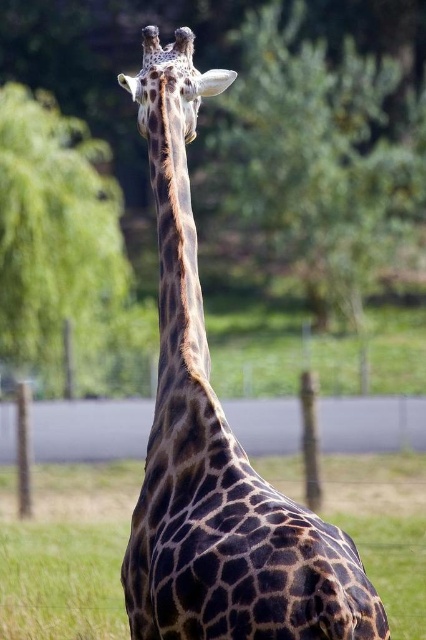
Which is above, spotted fur giraffe at center or brown textured neck at center?

brown textured neck at center

Between point (178, 586) and point (155, 147), which one is positioned in front?

Positioned in front is point (178, 586).

Which is behind, point (155, 540) or point (181, 157)?

The point (181, 157) is behind.

Image resolution: width=426 pixels, height=640 pixels. What are the coordinates of `spotted fur giraffe at center` in the screenshot? It's located at (215, 442).

Locate an element on the screen. Image resolution: width=426 pixels, height=640 pixels. green leafy tree at upper left is located at coordinates (54, 236).

Can you confirm if green leafy tree at upper left is bigger than spotted fur head at upper center?

Yes, green leafy tree at upper left is bigger than spotted fur head at upper center.

At what (x,y) coordinates should I click in order to perform the action: click on green leafy tree at upper left. Please return your answer as a coordinate pair (x, y). This screenshot has height=640, width=426. Looking at the image, I should click on click(x=54, y=236).

Measure the distance between point (158, 164) and camera.

Point (158, 164) is 5.56 meters away from camera.

Who is more distant from viewer, (198, 100) or (186, 76)?

The point (198, 100) is more distant.

Image resolution: width=426 pixels, height=640 pixels. Identify the location of spotted fur giraffe at center. (215, 442).